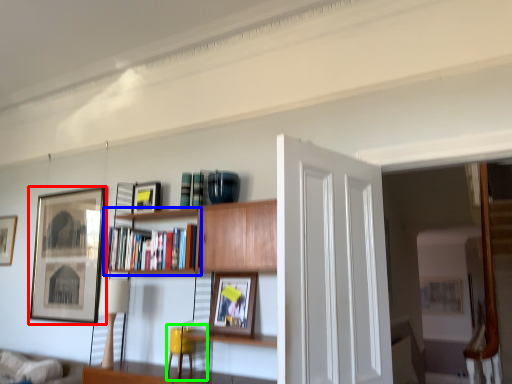
Question: Which object is the closest to the picture frame (highlighted by a red box)? Choose among these: shelf (highlighted by a blue box) or swivel chair (highlighted by a green box).

Choices:
 (A) shelf
 (B) swivel chair

Answer: (A)